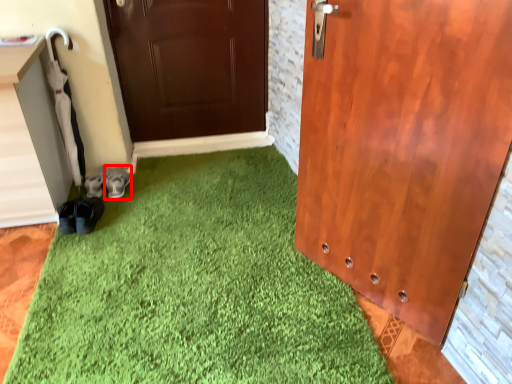
Question: In this image, where is footwear (annotated by the red box) located relative to footwear?

Choices:
 (A) right
 (B) left

Answer: (A)